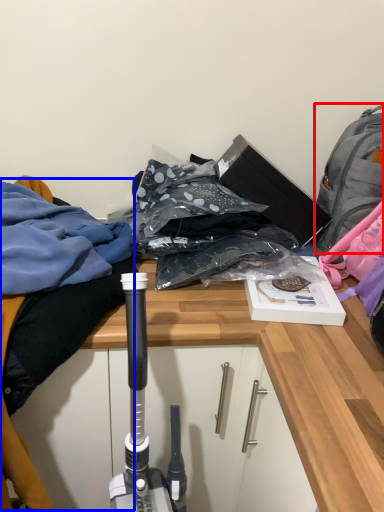
Question: Among these objects, which one is nearest to the camera, backpack (highlighted by a red box) or clothing (highlighted by a blue box)?

Choices:
 (A) backpack
 (B) clothing

Answer: (B)